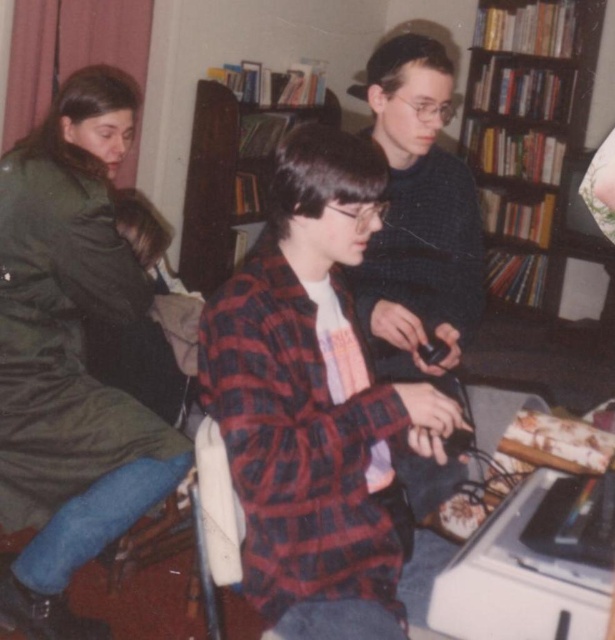
Can you confirm if red plaid shirt at center is shorter than green matte jacket at upper left?

Yes.

Can you confirm if red plaid shirt at center is thinner than green matte jacket at upper left?

Incorrect, red plaid shirt at center's width is not less than green matte jacket at upper left's.

Between point (317, 240) and point (68, 204), which one is positioned behind?

The point (68, 204) is more distant.

Identify the location of red plaid shirt at center. This screenshot has width=615, height=640. click(315, 403).

Does green matte jacket at upper left appear on the left side of wooden bookshelf at center?

Yes, green matte jacket at upper left is to the left of wooden bookshelf at center.

Does green matte jacket at upper left have a lesser height compared to wooden bookshelf at center?

In fact, green matte jacket at upper left may be taller than wooden bookshelf at center.

This screenshot has width=615, height=640. Describe the element at coordinates (71, 353) in the screenshot. I see `green matte jacket at upper left` at that location.

Identify the location of green matte jacket at upper left. (71, 353).

Between point (44, 461) and point (490, 208), which one is positioned in front?

Positioned in front is point (44, 461).

Does green matte jacket at upper left lie in front of dark brown wooden bookshelf at upper right?

Yes, it is.

Identify the location of green matte jacket at upper left. The width and height of the screenshot is (615, 640). (71, 353).